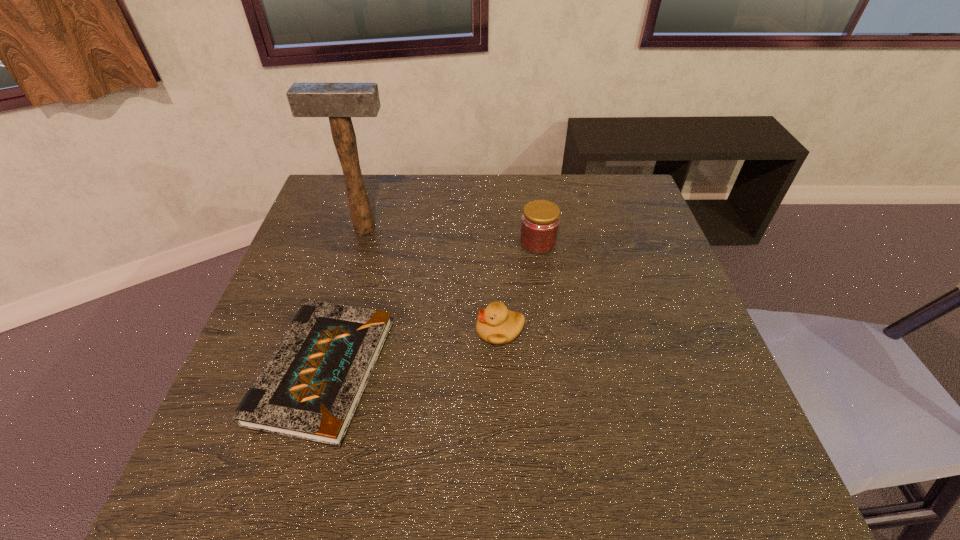
Find the location of a particular element. The width and height of the screenshot is (960, 540). free spot at the near right corner of the desktop is located at coordinates (753, 454).

This screenshot has height=540, width=960. I want to click on vacant area that lies between the jam and the third tallest object, so click(x=518, y=287).

Locate an element on the screen. The image size is (960, 540). vacant point located between the duckling and the tallest object is located at coordinates (432, 279).

The width and height of the screenshot is (960, 540). Find the location of `vacant area that lies between the second object from right to left and the jam`. vacant area that lies between the second object from right to left and the jam is located at coordinates (518, 287).

Where is `blank region between the tallest object and the notebook`? blank region between the tallest object and the notebook is located at coordinates point(344,300).

Locate an element on the screen. This screenshot has height=540, width=960. vacant area that lies between the mallet and the second object from right to left is located at coordinates (432, 279).

Where is `vacant point located between the third object from left to right and the mallet`? This screenshot has height=540, width=960. vacant point located between the third object from left to right and the mallet is located at coordinates (432, 279).

Find the location of a particular element. The image size is (960, 540). free spot between the jam and the mallet is located at coordinates (451, 235).

This screenshot has height=540, width=960. What are the coordinates of `vacant area between the notebook and the third tallest object` in the screenshot? It's located at (412, 351).

Where is `vacant area that lies between the tallest object and the third tallest object`? The image size is (960, 540). vacant area that lies between the tallest object and the third tallest object is located at coordinates (432, 279).